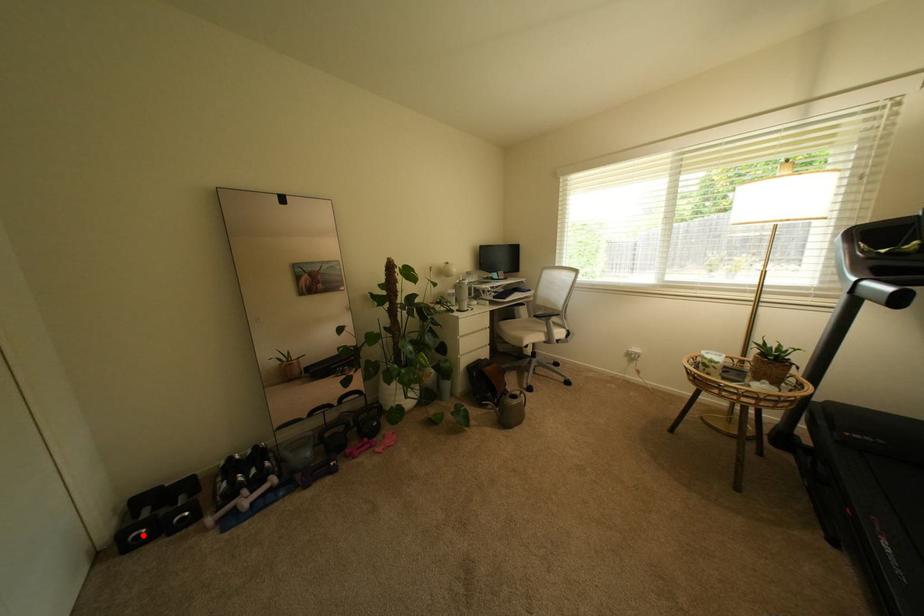
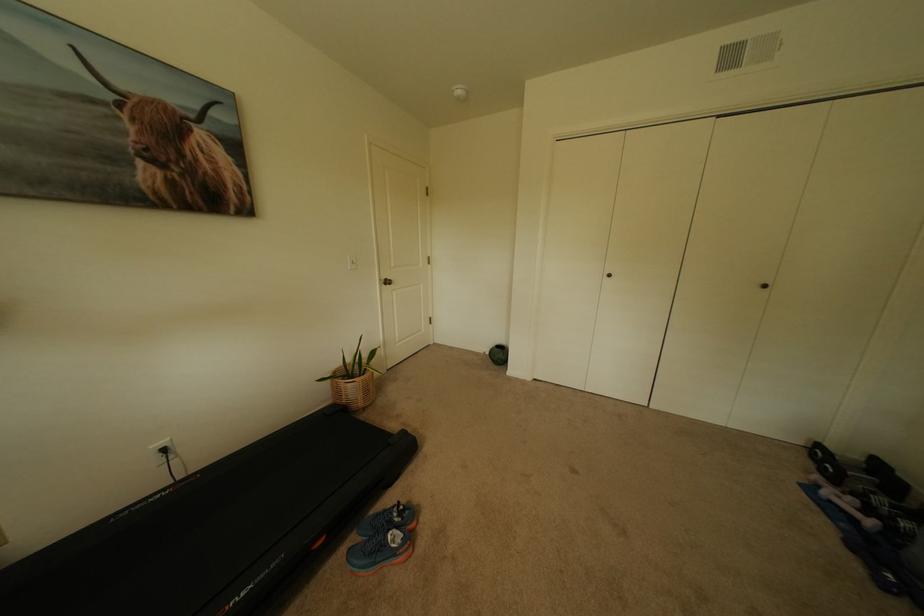
Question: I am providing you with two images of the same scene from different viewpoints. Image1 has a red point marked. In image2, the corresponding 3D location appears at what relative position? Reply with the corresponding letter.

Choices:
 (A) Closer
 (B) Farther

Answer: (B)